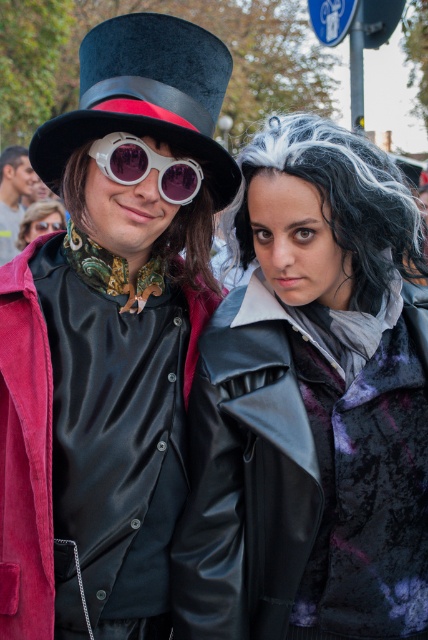
In the scene shown: You are a photographer at the event and want to ensure both the white matte wig at center and the white glossy goggles at center are clearly visible in your photo. Given their sizes, which object should you focus on first to ensure sharpness?

The white matte wig at center has a larger size compared to the white glossy goggles at center, so you should focus on the white matte wig at center first to ensure sharpness since it occupies more space in the frame.

You are a photographer at the event and need to ensure both the gray synthetic wig at center and the white glossy goggles at center are clearly visible in the photo. Given their sizes, which object should you focus on first to ensure it doesn

The gray synthetic wig at center is larger in size than the white glossy goggles at center, so you should focus on the gray synthetic wig at center first to ensure it is clearly visible before adjusting for the smaller white glossy goggles at center.